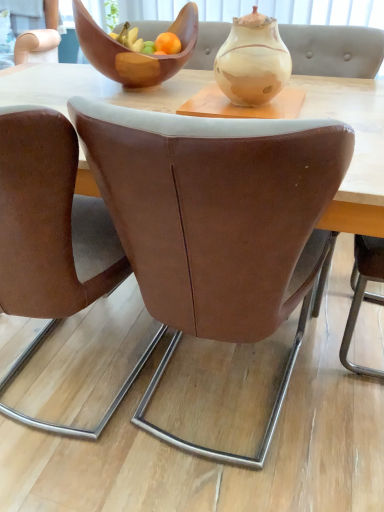
Question: Is marbled ceramic vase at center shorter than brown leather chair at center, marked as the second chair in a left-to-right arrangement?

Choices:
 (A) no
 (B) yes

Answer: (B)

Question: From a real-world perspective, is marbled ceramic vase at center under brown leather chair at center, the 1th chair in the right-to-left sequence?

Choices:
 (A) no
 (B) yes

Answer: (A)

Question: Considering the relative sizes of marbled ceramic vase at center and brown leather chair at center, marked as the second chair in a left-to-right arrangement, in the image provided, is marbled ceramic vase at center bigger than brown leather chair at center, marked as the second chair in a left-to-right arrangement,?

Choices:
 (A) no
 (B) yes

Answer: (A)

Question: Is marbled ceramic vase at center far from brown leather chair at center, marked as the second chair in a left-to-right arrangement?

Choices:
 (A) yes
 (B) no

Answer: (B)

Question: Does marbled ceramic vase at center have a smaller size compared to brown leather chair at center, marked as the second chair in a left-to-right arrangement?

Choices:
 (A) no
 (B) yes

Answer: (B)

Question: Is wooden bowl at upper center taller or shorter than marbled ceramic vase at center?

Choices:
 (A) tall
 (B) short

Answer: (A)

Question: Considering the positions of point (130, 53) and point (216, 72), is point (130, 53) closer or farther from the camera than point (216, 72)?

Choices:
 (A) farther
 (B) closer

Answer: (A)

Question: Is wooden bowl at upper center in front of or behind marbled ceramic vase at center in the image?

Choices:
 (A) behind
 (B) front

Answer: (A)

Question: Choose the correct answer: Is wooden bowl at upper center inside marbled ceramic vase at center or outside it?

Choices:
 (A) inside
 (B) outside

Answer: (B)

Question: From a real-world perspective, relative to brown leather chair at left, the first chair viewed from the left, is marbled ceramic vase at center vertically above or below?

Choices:
 (A) above
 (B) below

Answer: (A)

Question: Considering the positions of marbled ceramic vase at center and brown leather chair at left, the first chair viewed from the left, in the image, is marbled ceramic vase at center bigger or smaller than brown leather chair at left, the first chair viewed from the left,?

Choices:
 (A) small
 (B) big

Answer: (A)

Question: Would you say marbled ceramic vase at center is to the left or to the right of brown leather chair at left, acting as the 2th chair starting from the right, in the picture?

Choices:
 (A) left
 (B) right

Answer: (B)

Question: Is marbled ceramic vase at center inside the boundaries of brown leather chair at left, acting as the 2th chair starting from the right, or outside?

Choices:
 (A) outside
 (B) inside

Answer: (A)

Question: In terms of height, does marbled ceramic vase at center look taller or shorter compared to wooden bowl at upper center?

Choices:
 (A) tall
 (B) short

Answer: (B)

Question: In the image, is marbled ceramic vase at center on the left side or the right side of wooden bowl at upper center?

Choices:
 (A) right
 (B) left

Answer: (A)